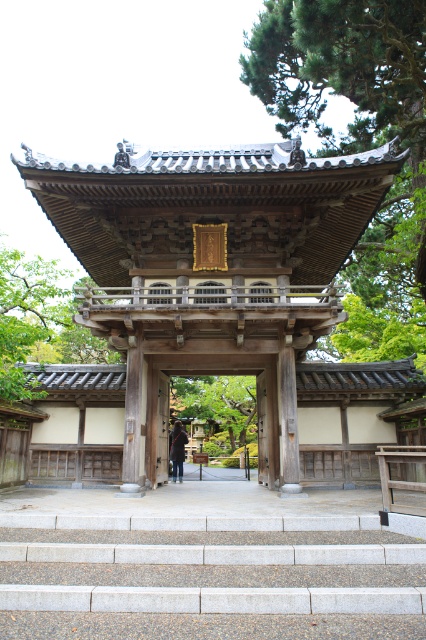
Does gray concrete stairs at lower center lie behind dark brown leather jacket at center?

That is False.

Does gray concrete stairs at lower center appear on the right side of dark brown leather jacket at center?

Indeed, gray concrete stairs at lower center is positioned on the right side of dark brown leather jacket at center.

What do you see at coordinates (212, 572) in the screenshot? I see `gray concrete stairs at lower center` at bounding box center [212, 572].

The width and height of the screenshot is (426, 640). I want to click on gray concrete stairs at lower center, so click(x=212, y=572).

Can you confirm if green leafy tree at center is positioned below dark brown leather jacket at center?

Correct, green leafy tree at center is located below dark brown leather jacket at center.

The height and width of the screenshot is (640, 426). Describe the element at coordinates (218, 406) in the screenshot. I see `green leafy tree at center` at that location.

Who is more distant from viewer, (219, 380) or (173, 442)?

Answer: Point (219, 380)

You are a GUI agent. You are given a task and a screenshot of the screen. Output one action in this format:
    pyautogui.click(x=<x>, y=<y>)
    Task: Click on the green leafy tree at center
    Image resolution: width=426 pixels, height=640 pixels.
    Given the screenshot: What is the action you would take?
    pyautogui.click(x=218, y=406)

Which of these two, wooden gate at center or dark brown leather jacket at center, stands shorter?

Standing shorter between the two is dark brown leather jacket at center.

Does wooden gate at center appear over dark brown leather jacket at center?

Indeed, wooden gate at center is positioned over dark brown leather jacket at center.

At what (x,y) coordinates should I click in order to perform the action: click on wooden gate at center. Please return your answer as a coordinate pair (x, y). Image resolution: width=426 pixels, height=640 pixels. Looking at the image, I should click on coord(210,268).

You are a GUI agent. You are given a task and a screenshot of the screen. Output one action in this format:
    pyautogui.click(x=<x>, y=<y>)
    Task: Click on the wooden gate at center
    
    Given the screenshot: What is the action you would take?
    tap(210, 268)